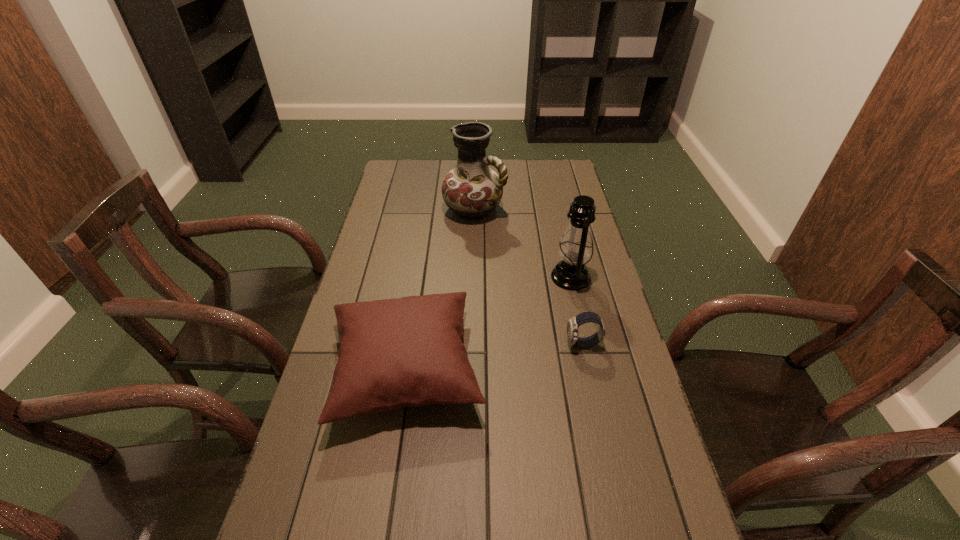
At what (x,y) coordinates should I click in order to perform the action: click on object that is at the left edge. Please return your answer as a coordinate pair (x, y). The image size is (960, 540). Looking at the image, I should click on (405, 352).

The width and height of the screenshot is (960, 540). In order to click on oil lamp situated at the right edge in this screenshot , I will do `click(576, 246)`.

At what (x,y) coordinates should I click in order to perform the action: click on watch that is at the right edge. Please return your answer as a coordinate pair (x, y). The height and width of the screenshot is (540, 960). Looking at the image, I should click on (573, 324).

The width and height of the screenshot is (960, 540). In the image, there is a desktop. What are the coordinates of `vacant space at the left edge` in the screenshot? It's located at (363, 416).

Locate an element on the screen. vacant space at the right edge of the desktop is located at coordinates (584, 303).

Image resolution: width=960 pixels, height=540 pixels. I want to click on blank area at the far right corner, so click(x=541, y=178).

Find the location of a particular element. This screenshot has height=540, width=960. free spot between the watch and the third nearest object is located at coordinates (577, 310).

At what (x,y) coordinates should I click in order to perform the action: click on vacant area between the cushion and the watch. Please return your answer as a coordinate pair (x, y). Looking at the image, I should click on (494, 356).

Locate an element on the screen. unoccupied position between the oil lamp and the vase is located at coordinates (522, 244).

You are a GUI agent. You are given a task and a screenshot of the screen. Output one action in this format:
    pyautogui.click(x=<x>, y=<y>)
    Task: Click on the free space between the third tallest object and the second farthest object
    Image resolution: width=960 pixels, height=540 pixels.
    Given the screenshot: What is the action you would take?
    pyautogui.click(x=488, y=323)